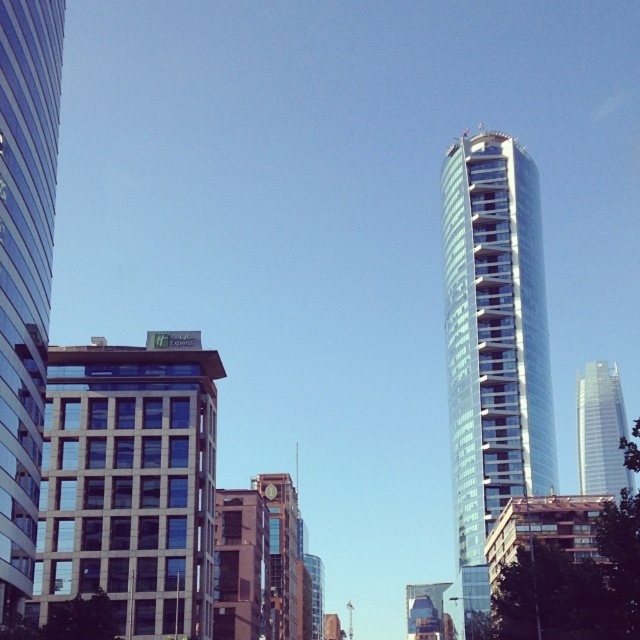
Question: Based on their relative distances, which object is nearer to the glassy reflective skyscraper at left?

Choices:
 (A) shiny glass skyscraper at right
 (B) brick textured clock tower at center
 (C) transparent glass tower at right
 (D) beige stone building at center

Answer: (D)

Question: Is transparent glass tower at right above glassy reflective skyscraper at left?

Choices:
 (A) yes
 (B) no

Answer: (B)

Question: Can you confirm if transparent glass tower at right is positioned below glassy reflective skyscraper at left?

Choices:
 (A) no
 (B) yes

Answer: (B)

Question: Is transparent glass tower at right closer to the viewer compared to brick textured clock tower at center?

Choices:
 (A) yes
 (B) no

Answer: (B)

Question: Which of these objects is positioned closest to the shiny glass skyscraper at right?

Choices:
 (A) glassy reflective skyscraper at left
 (B) beige stone building at center
 (C) brick textured clock tower at center
 (D) transparent glass tower at right

Answer: (D)

Question: Which is nearer to the brick textured clock tower at center?

Choices:
 (A) shiny glass skyscraper at right
 (B) beige stone building at center

Answer: (B)